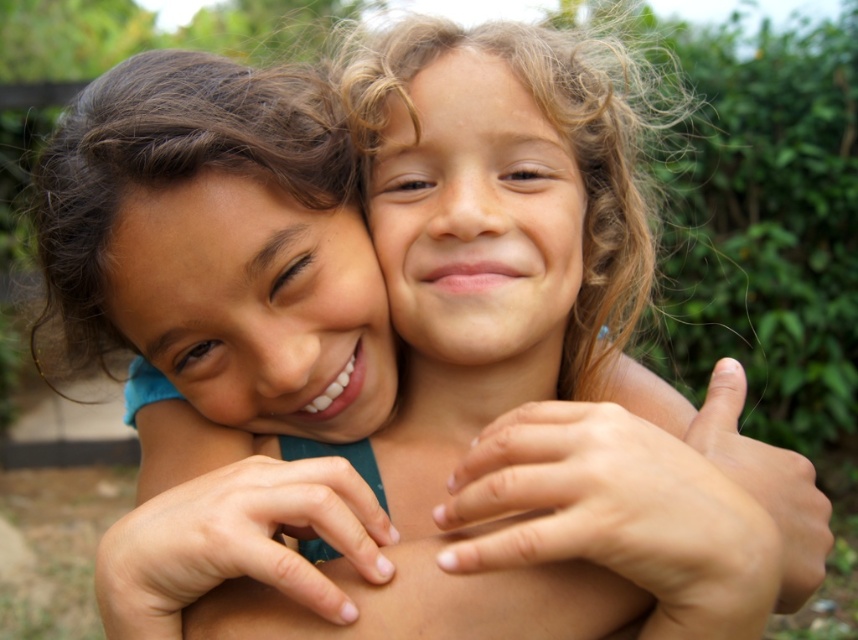
You are standing in a park and see a point marked at coordinates (313, 410). If you want to touch this point with a stick that is 20 inches long, will you be able to reach it?

The point at (313, 410) is 21.97 inches away from the viewer. Since the stick is only 20 inches long, you won not be able to reach it.

You are a photographer who wants to ensure both the smooth skin face at center and the curly hair at center are clearly visible in the photo. Given their sizes, which one might require more careful focusing to avoid blurriness?

The smooth skin face at center is shorter than the curly hair at center, so the curly hair at center might require more careful focusing because it is taller and could be more prone to blurriness if not properly focused.